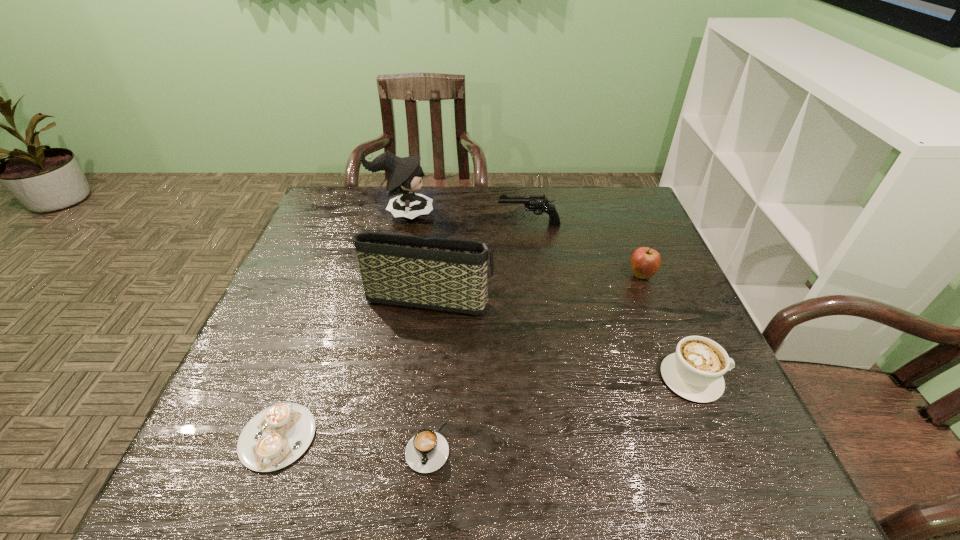
Locate which cappuccino ranks second in proximity to the rightmost cappuccino. Please provide its 2D coordinates. Your answer should be formatted as a tuple, i.e. [(x, y)], where the tuple contains the x and y coordinates of a point satisfying the conditions above.

[(277, 436)]

Image resolution: width=960 pixels, height=540 pixels. I want to click on cappuccino object that ranks as the second closest to the handbag, so click(427, 451).

You are a GUI agent. You are given a task and a screenshot of the screen. Output one action in this format:
    pyautogui.click(x=<x>, y=<y>)
    Task: Click on the vacant area that satisfies the following two spatial constraints: 1. at the end of the barrel of the apple; 2. on the right side of the fifth object from left to right
    
    Given the screenshot: What is the action you would take?
    pyautogui.click(x=536, y=275)

You are a GUI agent. You are given a task and a screenshot of the screen. Output one action in this format:
    pyautogui.click(x=<x>, y=<y>)
    Task: Click on the free space that satisfies the following two spatial constraints: 1. at the end of the barrel of the gun; 2. on the front side of the handbag
    The width and height of the screenshot is (960, 540).
    Given the screenshot: What is the action you would take?
    (539, 293)

At what (x,y) coordinates should I click in order to perform the action: click on vacant space that satisfies the following two spatial constraints: 1. at the face of the doll; 2. on the back side of the handbag. Please return your answer as a coordinate pair (x, y). Looking at the image, I should click on (384, 293).